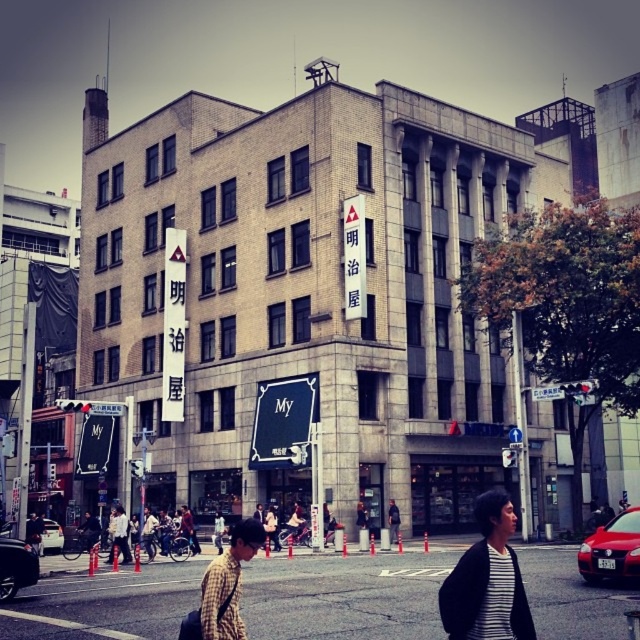
Is striped cotton shirt at center bigger than white plastic street sign at center?

Yes.

The width and height of the screenshot is (640, 640). What do you see at coordinates (486, 580) in the screenshot?
I see `striped cotton shirt at center` at bounding box center [486, 580].

Image resolution: width=640 pixels, height=640 pixels. What do you see at coordinates (486, 580) in the screenshot?
I see `striped cotton shirt at center` at bounding box center [486, 580].

What are the coordinates of `striped cotton shirt at center` in the screenshot? It's located at point(486,580).

Is plaid fabric shirt at center thinner than white plastic street sign at center?

Incorrect, plaid fabric shirt at center's width is not less than white plastic street sign at center's.

Does plaid fabric shirt at center have a larger size compared to white plastic street sign at center?

Yes, plaid fabric shirt at center is bigger than white plastic street sign at center.

Is point (236, 620) positioned behind point (564, 392)?

No, it is in front of (564, 392).

I want to click on plaid fabric shirt at center, so click(x=227, y=582).

The height and width of the screenshot is (640, 640). I want to click on striped cotton shirt at center, so click(x=486, y=580).

The image size is (640, 640). What do you see at coordinates (486, 580) in the screenshot? I see `striped cotton shirt at center` at bounding box center [486, 580].

The width and height of the screenshot is (640, 640). Identify the location of striped cotton shirt at center. (486, 580).